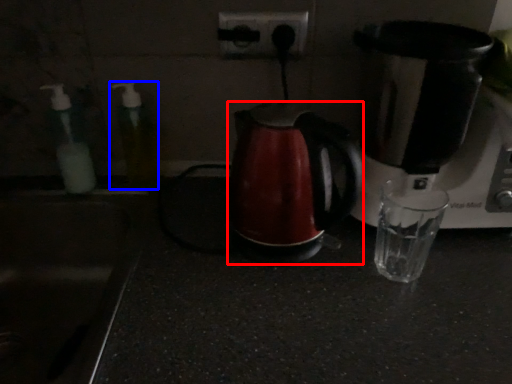
Question: Which point is closer to the camera, kettle (highlighted by a red box) or bottle (highlighted by a blue box)?

Choices:
 (A) kettle
 (B) bottle

Answer: (A)